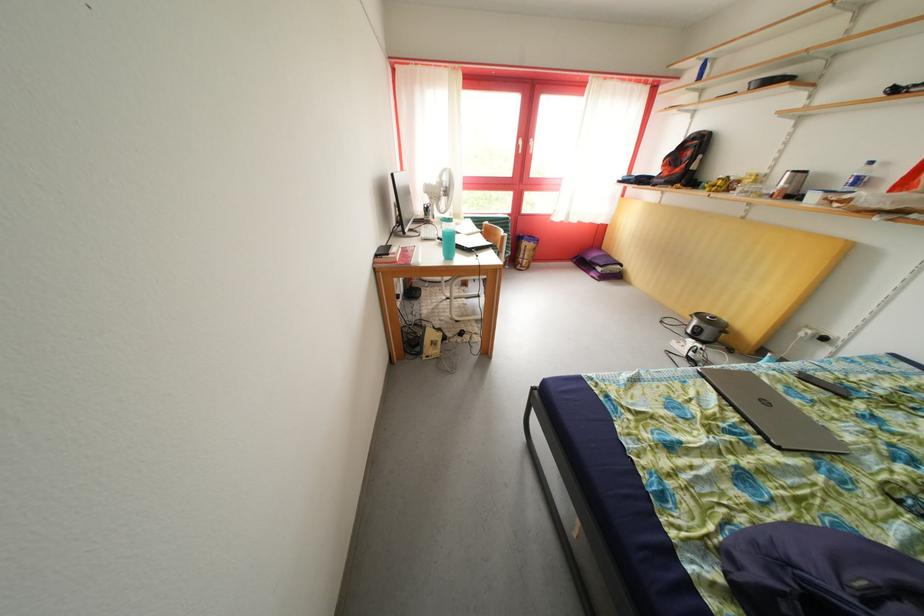
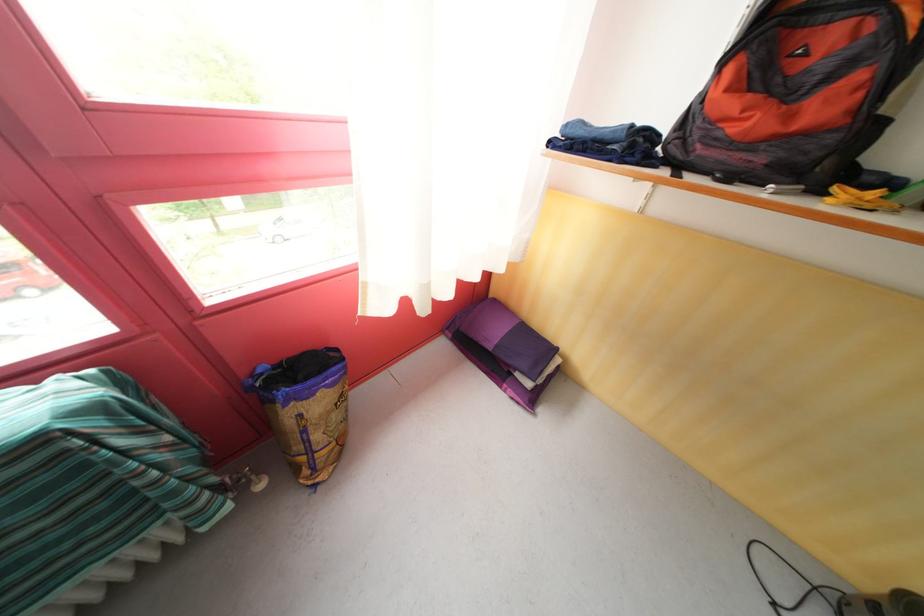
Find the pixel in the second image that matches pixel 669 184 in the first image.

(736, 151)